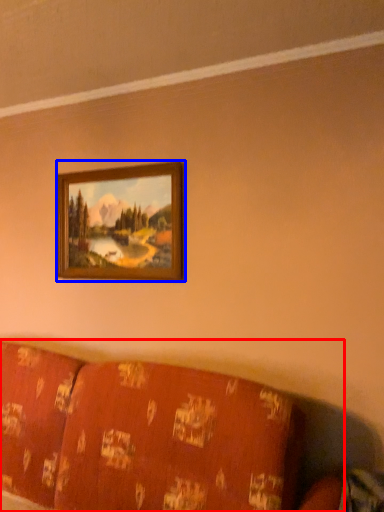
Question: Which object appears closest to the camera in this image, furniture (highlighted by a red box) or picture frame (highlighted by a blue box)?

Choices:
 (A) furniture
 (B) picture frame

Answer: (A)